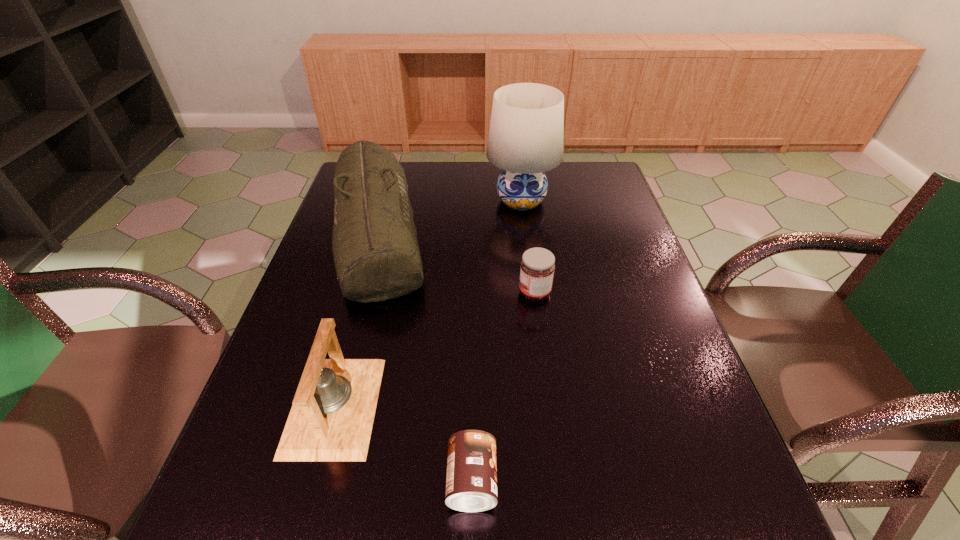
Identify the location of lampshade. The width and height of the screenshot is (960, 540). (525, 140).

Find the location of a particular element. This screenshot has height=540, width=960. duffel bag is located at coordinates (377, 257).

Where is `bell`? bell is located at coordinates (331, 419).

You are a GUI agent. You are given a task and a screenshot of the screen. Output one action in this format:
    pyautogui.click(x=<x>, y=<y>)
    Task: Click on the second shortest object
    
    Given the screenshot: What is the action you would take?
    pyautogui.click(x=537, y=266)

Where is `can`? The image size is (960, 540). can is located at coordinates (471, 483).

The width and height of the screenshot is (960, 540). Find the location of `vacant space located on the front-facing side of the lampshade`. vacant space located on the front-facing side of the lampshade is located at coordinates (531, 278).

This screenshot has height=540, width=960. What are the coordinates of `vacant space located on the front of the duffel bag` in the screenshot? It's located at (329, 406).

This screenshot has height=540, width=960. I want to click on free space located 0.240m on the back of the bell, so click(367, 284).

Locate an element on the screen. This screenshot has height=540, width=960. free location located on the left of the second shortest object is located at coordinates (396, 293).

I want to click on vacant area situated 0.190m on the front label of the shortest object, so click(604, 481).